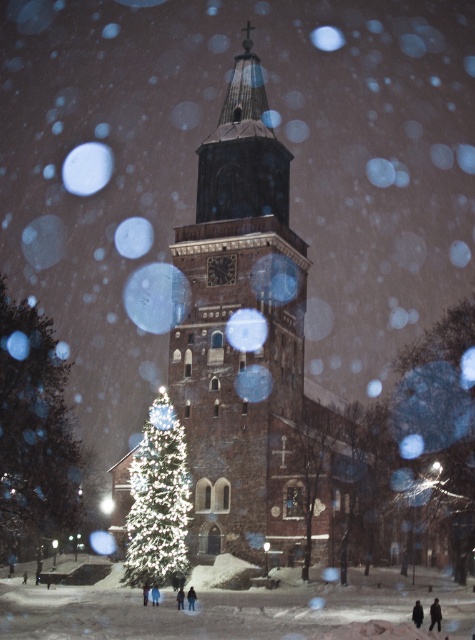
Between green frosted tree at right and illuminated glass christmas tree at center, which one has less height?

Standing shorter between the two is illuminated glass christmas tree at center.

Based on the photo, can you confirm if green frosted tree at right is positioned below illuminated glass christmas tree at center?

No.

This screenshot has height=640, width=475. What are the coordinates of `green frosted tree at right` in the screenshot? It's located at (437, 381).

Can you confirm if green frosted tree at left is positioned to the left of green frosted tree at right?

Yes, green frosted tree at left is to the left of green frosted tree at right.

Which is in front, point (9, 406) or point (463, 321)?

Point (9, 406)

Between point (70, 476) and point (414, 401), which one is positioned in front?

Point (70, 476) is in front.

The width and height of the screenshot is (475, 640). I want to click on green frosted tree at left, so click(34, 433).

Which is behind, point (275, 449) or point (443, 428)?

Point (443, 428)

Between brown stone church at center and green frosted tree at right, which one is positioned lower?

green frosted tree at right

Who is more forward, [116,502] or [454,332]?

Point [116,502] is more forward.

I want to click on brown stone church at center, so click(254, 355).